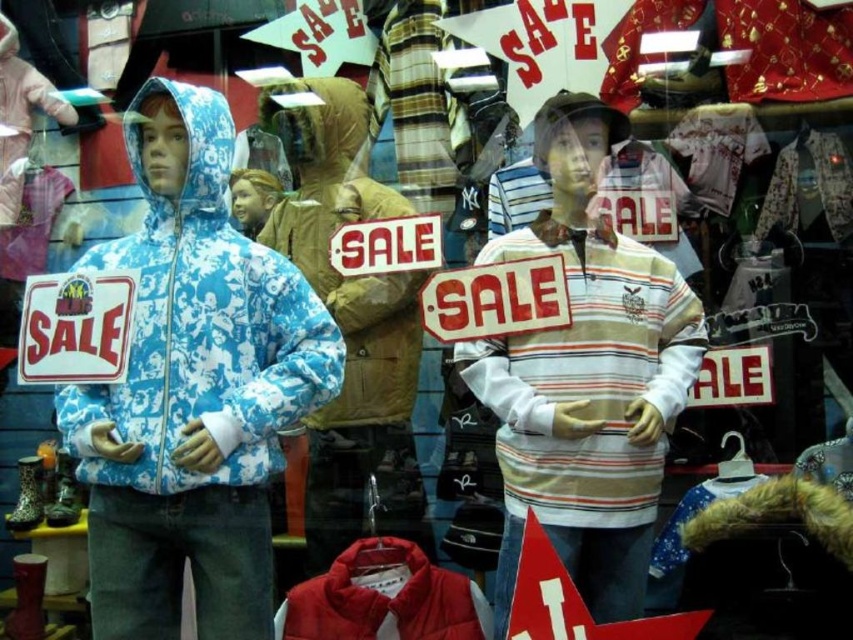
Is point (596, 406) positioned behind point (329, 120)?

No, (596, 406) is in front of (329, 120).

Can you confirm if striped cotton shirt at center is thinner than brown fuzzy jacket at center?

Incorrect, striped cotton shirt at center's width is not less than brown fuzzy jacket at center's.

The height and width of the screenshot is (640, 853). What do you see at coordinates (585, 376) in the screenshot? I see `striped cotton shirt at center` at bounding box center [585, 376].

Where is `striped cotton shirt at center`? striped cotton shirt at center is located at coordinates (585, 376).

The image size is (853, 640). What do you see at coordinates (328, 256) in the screenshot?
I see `brown fuzzy jacket at center` at bounding box center [328, 256].

Is brown fuzzy jacket at center shorter than red down jacket at lower center?

No.

Which is behind, point (358, 368) or point (448, 589)?

Point (358, 368)

What are the coordinates of `brown fuzzy jacket at center` in the screenshot? It's located at (328, 256).

Can you confirm if striped cotton shirt at center is positioned to the right of red down jacket at lower center?

Yes, striped cotton shirt at center is to the right of red down jacket at lower center.

Does striped cotton shirt at center appear over red down jacket at lower center?

Yes, striped cotton shirt at center is above red down jacket at lower center.

Identify the location of striped cotton shirt at center. (585, 376).